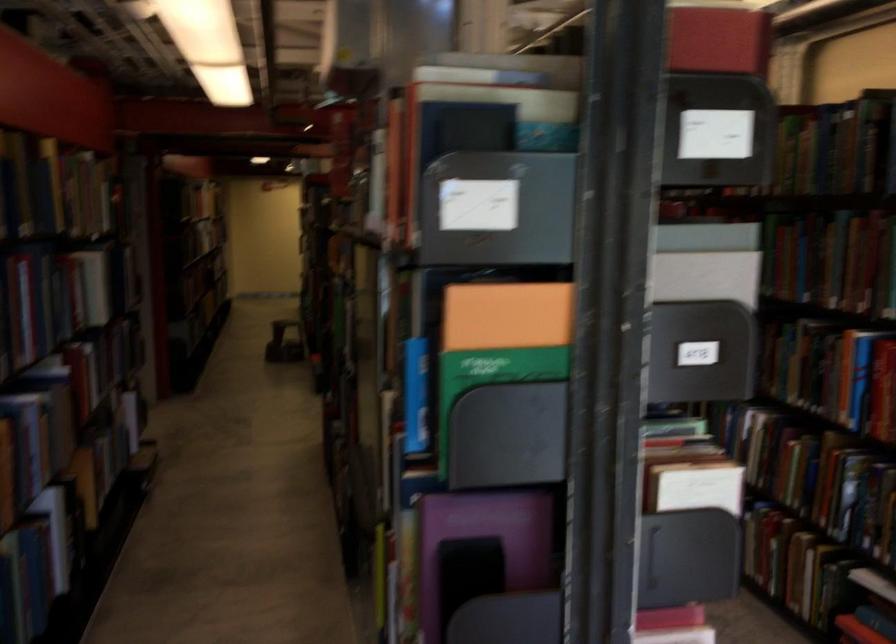
I want to click on purple book, so click(x=489, y=532).